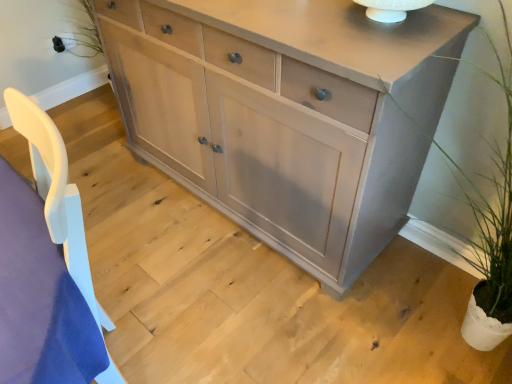
Question: From the image's perspective, is green leafy plant at right located above or below matte gray cabinet at center?

Choices:
 (A) above
 (B) below

Answer: (B)

Question: Based on their sizes in the image, would you say green leafy plant at right is bigger or smaller than matte gray cabinet at center?

Choices:
 (A) big
 (B) small

Answer: (B)

Question: Do you think green leafy plant at right is within matte gray cabinet at center, or outside of it?

Choices:
 (A) inside
 (B) outside

Answer: (B)

Question: Is matte gray cabinet at center wider or thinner than green leafy plant at right?

Choices:
 (A) wide
 (B) thin

Answer: (B)

Question: Would you say matte gray cabinet at center is to the left or to the right of green leafy plant at right in the picture?

Choices:
 (A) left
 (B) right

Answer: (A)

Question: In terms of height, does matte gray cabinet at center look taller or shorter compared to green leafy plant at right?

Choices:
 (A) short
 (B) tall

Answer: (A)

Question: Is matte gray cabinet at center bigger or smaller than green leafy plant at right?

Choices:
 (A) big
 (B) small

Answer: (A)